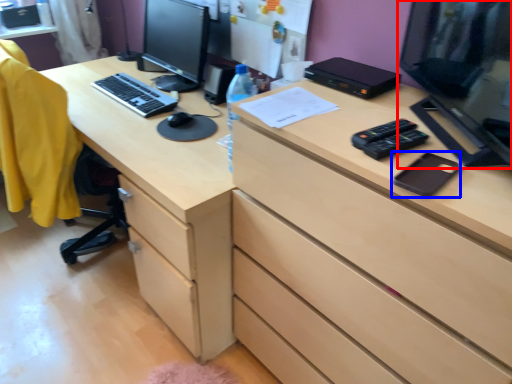
Question: Which object is further to the camera taking this photo, computer monitor (highlighted by a red box) or notepad (highlighted by a blue box)?

Choices:
 (A) computer monitor
 (B) notepad

Answer: (B)